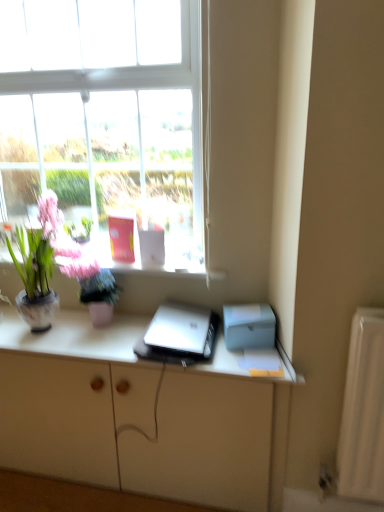
Question: Can you confirm if matte ceramic vase at left is shorter than matte white cabinet at center?

Choices:
 (A) yes
 (B) no

Answer: (A)

Question: Is matte ceramic vase at left outside of matte white cabinet at center?

Choices:
 (A) no
 (B) yes

Answer: (B)

Question: Does matte ceramic vase at left come in front of matte white cabinet at center?

Choices:
 (A) no
 (B) yes

Answer: (A)

Question: Is matte ceramic vase at left to the right of matte white cabinet at center from the viewer's perspective?

Choices:
 (A) yes
 (B) no

Answer: (B)

Question: Is matte ceramic vase at left bigger than matte white cabinet at center?

Choices:
 (A) yes
 (B) no

Answer: (B)

Question: Based on their sizes in the image, would you say silver metallic laptop at center is bigger or smaller than silver metallic laptop at center?

Choices:
 (A) big
 (B) small

Answer: (A)

Question: Is silver metallic laptop at center taller or shorter than silver metallic laptop at center?

Choices:
 (A) tall
 (B) short

Answer: (B)

Question: Is silver metallic laptop at center in front of or behind silver metallic laptop at center in the image?

Choices:
 (A) behind
 (B) front

Answer: (B)

Question: Considering the relative positions of silver metallic laptop at center and silver metallic laptop at center in the image provided, is silver metallic laptop at center to the left or to the right of silver metallic laptop at center?

Choices:
 (A) left
 (B) right

Answer: (A)

Question: Considering the positions of silver metallic laptop at center and transparent glass window at upper center in the image, is silver metallic laptop at center wider or thinner than transparent glass window at upper center?

Choices:
 (A) wide
 (B) thin

Answer: (A)

Question: From the image's perspective, is silver metallic laptop at center above or below transparent glass window at upper center?

Choices:
 (A) above
 (B) below

Answer: (B)

Question: Is point (61, 314) positioned closer to the camera than point (87, 67)?

Choices:
 (A) closer
 (B) farther

Answer: (B)

Question: Is silver metallic laptop at center bigger or smaller than transparent glass window at upper center?

Choices:
 (A) small
 (B) big

Answer: (A)

Question: Considering the relative positions of matte ceramic vase at left and transparent glass window at upper center in the image provided, is matte ceramic vase at left to the left or to the right of transparent glass window at upper center?

Choices:
 (A) right
 (B) left

Answer: (B)

Question: From a real-world perspective, relative to transparent glass window at upper center, is matte ceramic vase at left vertically above or below?

Choices:
 (A) above
 (B) below

Answer: (B)